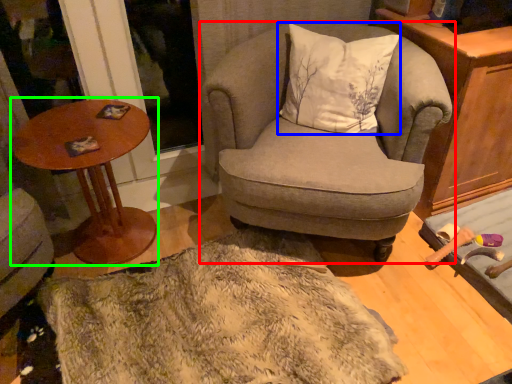
Question: Considering the real-world distances, which object is closest to chair (highlighted by a red box)? pillow (highlighted by a blue box) or table (highlighted by a green box).

Choices:
 (A) pillow
 (B) table

Answer: (A)